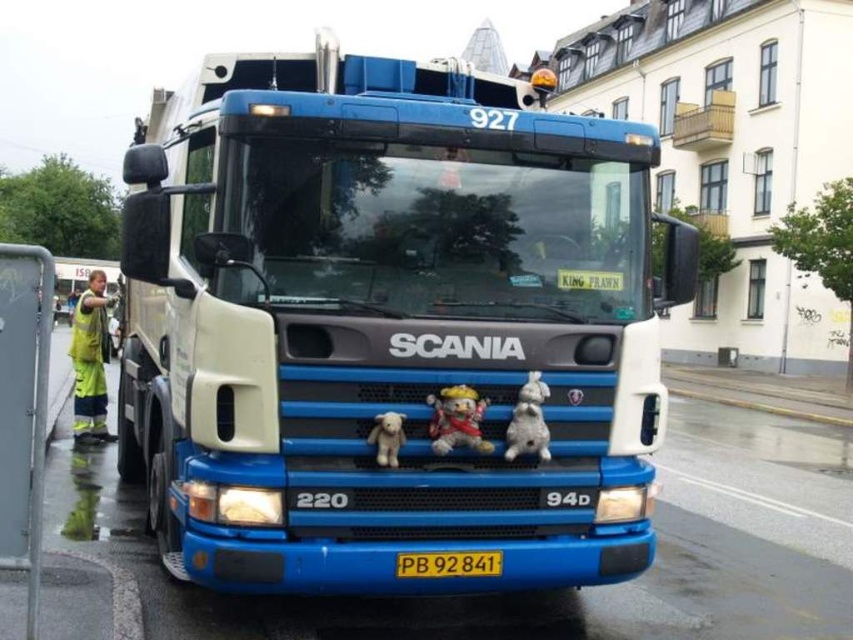
You are standing at the point marked as point (389, 324). What object is exactly at this point?

The blue matte truck at center is located at point (389, 324).